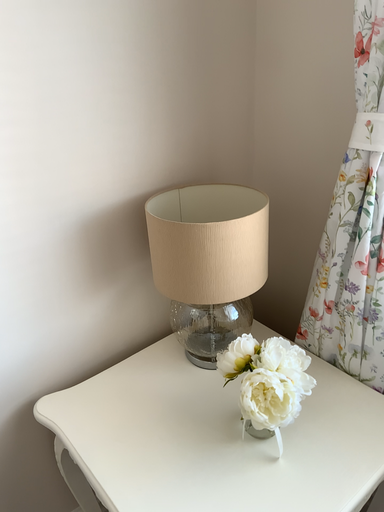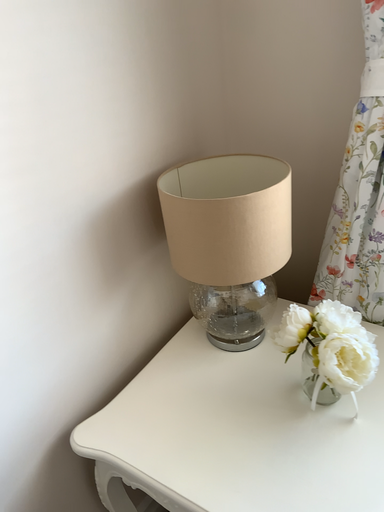
Question: How did the camera likely rotate when shooting the video?

Choices:
 (A) rotated right
 (B) rotated left

Answer: (A)